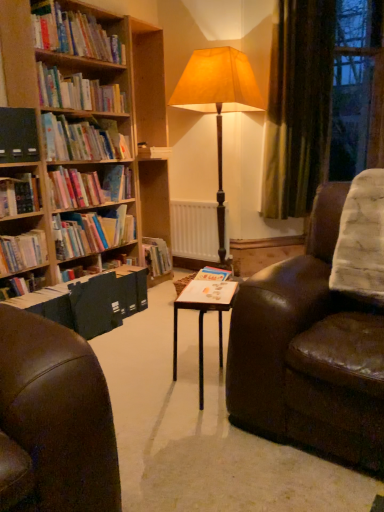
Image resolution: width=384 pixels, height=512 pixels. Find the location of `vacant space to the left of white wooden table at center`. vacant space to the left of white wooden table at center is located at coordinates (146, 384).